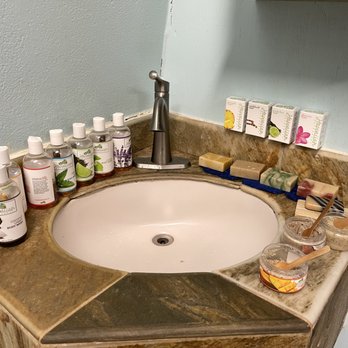
Identify the location of container holding soap mixture. This screenshot has width=348, height=348. (312, 231), (334, 226), (281, 259).